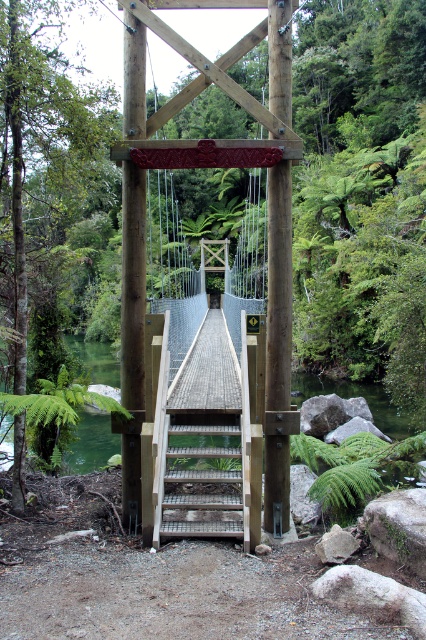
Question: Is wooden suspension bridge at center smaller than wooden stairs at center?

Choices:
 (A) yes
 (B) no

Answer: (B)

Question: Which of the following is the closest to the observer?

Choices:
 (A) wooden suspension bridge at center
 (B) wooden stairs at center
 (C) green water at center

Answer: (B)

Question: Which of the following is the farthest from the observer?

Choices:
 (A) (155, 518)
 (B) (311, 388)

Answer: (B)

Question: Which point appears farthest from the camera in this image?

Choices:
 (A) (98, 390)
 (B) (258, 352)

Answer: (A)

Question: Does wooden stairs at center have a smaller size compared to green water at center?

Choices:
 (A) yes
 (B) no

Answer: (A)

Question: Is wooden suspension bridge at center wider than wooden stairs at center?

Choices:
 (A) no
 (B) yes

Answer: (B)